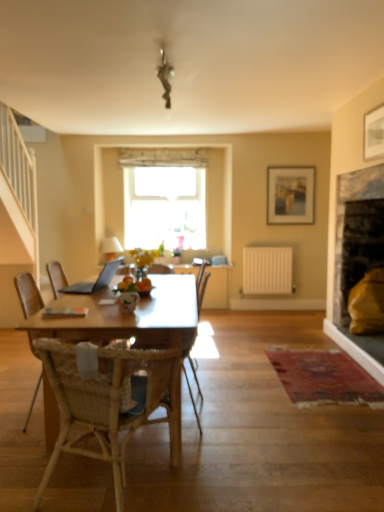
What do you see at coordinates (28, 294) in the screenshot? The image size is (384, 512). I see `woven wood chair at center, acting as the second chair starting from the front` at bounding box center [28, 294].

Image resolution: width=384 pixels, height=512 pixels. What are the coordinates of `transparent glass window at center` in the screenshot? It's located at (164, 198).

You are a GUI agent. You are given a task and a screenshot of the screen. Output one action in this format:
    pyautogui.click(x=<x>, y=<y>)
    Task: Click on the matte wooden picture frame at upper center, the second picture frame positioned from the right
    The width and height of the screenshot is (384, 512).
    Given the screenshot: What is the action you would take?
    pyautogui.click(x=290, y=195)

In order to face white matte radiator at center-right, should I rotate leftwards or rightwards?

Rotate your view right by about 10.256°.

Where is `woven wood chair at center, which is the 1th chair from front to back`? This screenshot has width=384, height=512. woven wood chair at center, which is the 1th chair from front to back is located at coordinates (106, 400).

Locate an element on the screen. woven wood chair at center, which is counted as the second chair, starting from the back is located at coordinates (28, 294).

Identify the location of the 2nd chair in front of the wooden picture frame at upper right, which appears as the first picture frame when viewed from the right, counting from the anchor's position. The height and width of the screenshot is (512, 384). (28, 294).

Consider the image. From the image's perspective, is woven wood chair at center, acting as the second chair starting from the front, over wooden picture frame at upper right, which appears as the first picture frame when viewed from the right?

No, from the image's perspective, woven wood chair at center, acting as the second chair starting from the front, is not on top of wooden picture frame at upper right, which appears as the first picture frame when viewed from the right.

What's the angular difference between woven wood chair at center, which is counted as the second chair, starting from the back, and wooden picture frame at upper right, which is counted as the 2th picture frame, starting from the back,'s facing directions?

1.02 degrees.

From the picture: Is white matte radiator at center-right at the right side of woven wood chair at center, the 3th chair when ordered from front to back?

Yes, white matte radiator at center-right is to the right of woven wood chair at center, the 3th chair when ordered from front to back.

From the image's perspective, is white matte radiator at center-right under woven wood chair at center, the 3th chair when ordered from front to back?

No, from the image's perspective, white matte radiator at center-right is not beneath woven wood chair at center, the 3th chair when ordered from front to back.

Does white matte radiator at center-right have a larger size compared to woven wood chair at center, the 1th chair when ordered from back to front?

Incorrect, white matte radiator at center-right is not larger than woven wood chair at center, the 1th chair when ordered from back to front.

Would you say white matte radiator at center-right is outside woven wood chair at center, the 1th chair when ordered from back to front?

Yes, white matte radiator at center-right is outside of woven wood chair at center, the 1th chair when ordered from back to front.

How many degrees apart are the facing directions of woven wood chair at center, which is counted as the second chair, starting from the back, and woven wood chair at center, the 3th chair when ordered from front to back?

0.611 degrees separate the facing orientations of woven wood chair at center, which is counted as the second chair, starting from the back, and woven wood chair at center, the 3th chair when ordered from front to back.

Could you tell me if woven wood chair at center, acting as the second chair starting from the front, is facing woven wood chair at center, the 3th chair when ordered from front to back?

Yes, woven wood chair at center, acting as the second chair starting from the front, faces towards woven wood chair at center, the 3th chair when ordered from front to back.

Which is behind, point (17, 290) or point (189, 351)?

The point (17, 290) is more distant.

From the image's perspective, between woven wood chair at center, which is counted as the second chair, starting from the back, and woven wood chair at center, the 3th chair when ordered from front to back, which one is located above?

woven wood chair at center, the 3th chair when ordered from front to back, appears higher in the image.

Which object is wider, woven wood chair at center, the 3th chair when ordered from front to back, or white matte radiator at center-right?

woven wood chair at center, the 3th chair when ordered from front to back, is wider.

Is woven wood chair at center, the 3th chair when ordered from front to back, positioned far away from white matte radiator at center-right?

No, there isn't a large distance between woven wood chair at center, the 3th chair when ordered from front to back, and white matte radiator at center-right.

Is woven wood chair at center, the 1th chair when ordered from back to front, not within white matte radiator at center-right?

Yes.

Between woven wood chair at center, the 3th chair when ordered from front to back, and white matte radiator at center-right, which one has smaller size?

white matte radiator at center-right.

From a real-world perspective, which is physically below, woven wood chair at center, acting as the second chair starting from the front, or silver metallic laptop at center?

From a 3D spatial view, woven wood chair at center, acting as the second chair starting from the front, is below.

Is point (20, 277) farther from viewer compared to point (78, 293)?

No.

From the image's perspective, who appears lower, woven wood chair at center, which is counted as the second chair, starting from the back, or silver metallic laptop at center?

woven wood chair at center, which is counted as the second chair, starting from the back, from the image's perspective.

Considering the sizes of woven wood chair at center, which ranks as the third chair in back-to-front order, and silver metallic laptop at center in the image, is woven wood chair at center, which ranks as the third chair in back-to-front order, wider or thinner than silver metallic laptop at center?

In the image, woven wood chair at center, which ranks as the third chair in back-to-front order, appears to be wider than silver metallic laptop at center.

Between point (123, 454) and point (80, 284), which one is positioned behind?

The point (80, 284) is more distant.

Does woven wood chair at center, which ranks as the third chair in back-to-front order, turn towards silver metallic laptop at center?

No, woven wood chair at center, which ranks as the third chair in back-to-front order, is not aimed at silver metallic laptop at center.

Considering the relative positions of silver metallic laptop at center and woven wood chair at center, acting as the second chair starting from the front, in the image provided, is silver metallic laptop at center in front of woven wood chair at center, acting as the second chair starting from the front,?

No.

From the picture: Considering the relative sizes of silver metallic laptop at center and woven wood chair at center, acting as the second chair starting from the front, in the image provided, is silver metallic laptop at center smaller than woven wood chair at center, acting as the second chair starting from the front,?

Yes, silver metallic laptop at center is smaller than woven wood chair at center, acting as the second chair starting from the front.

Considering the sizes of silver metallic laptop at center and woven wood chair at center, acting as the second chair starting from the front, in the image, is silver metallic laptop at center wider or thinner than woven wood chair at center, acting as the second chair starting from the front,?

silver metallic laptop at center is thinner than woven wood chair at center, acting as the second chair starting from the front.

From a real-world perspective, who is located higher, silver metallic laptop at center or woven wood chair at center, which is counted as the second chair, starting from the back?

silver metallic laptop at center, from a real-world perspective.

From the image's perspective, starting from the woven wood chair at center, which is counted as the second chair, starting from the back, which picture frame is the 2nd one above? Please provide its 2D coordinates.

[(374, 133)]

Where is `radiator above the woven wood chair at center, the 1th chair when ordered from back to front (from a real-world perspective)`? radiator above the woven wood chair at center, the 1th chair when ordered from back to front (from a real-world perspective) is located at coordinates [x=267, y=270].

Which object lies further to the anchor point transparent glass window at center, woven wood chair at center, the 1th chair when ordered from back to front, or woven wood chair at center, which is the 1th chair from front to back?

woven wood chair at center, which is the 1th chair from front to back, lies further to transparent glass window at center than the other object.

Which object lies nearer to the anchor point silver metallic laptop at center, woven wood chair at center, which is the 1th chair from front to back, or white matte radiator at center-right?

woven wood chair at center, which is the 1th chair from front to back, is closer to silver metallic laptop at center.

Looking at the image, which one is located further to transparent glass window at center, woven wood chair at center, the 3th chair when ordered from front to back, or matte wooden picture frame at upper center, the second picture frame positioned from the right?

Among the two, woven wood chair at center, the 3th chair when ordered from front to back, is located further to transparent glass window at center.

Estimate the real-world distances between objects in this image. Which object is further from matte wooden picture frame at upper center, the 2th picture frame from the front, white glossy vase at center or wooden picture frame at upper right, which is counted as the 2th picture frame, starting from the back?

white glossy vase at center lies further to matte wooden picture frame at upper center, the 2th picture frame from the front, than the other object.

Looking at this image, estimate the real-world distances between objects in this image. Which object is further from woven wood chair at center, acting as the second chair starting from the front, white matte radiator at center-right or woven wood chair at center, the 1th chair when ordered from back to front?

The object further to woven wood chair at center, acting as the second chair starting from the front, is white matte radiator at center-right.

Estimate the real-world distances between objects in this image. Which object is further from transparent glass window at center, woven wood chair at center, which ranks as the third chair in back-to-front order, or woven wood chair at center, the 3th chair when ordered from front to back?

woven wood chair at center, which ranks as the third chair in back-to-front order, is positioned further to the anchor transparent glass window at center.

Considering their positions, is matte wooden picture frame at upper center, the 2th picture frame from the front, positioned further to white glossy vase at center than white matte radiator at center-right?

The object further to white glossy vase at center is matte wooden picture frame at upper center, the 2th picture frame from the front.

When comparing their distances from white glossy vase at center, does white matte radiator at center-right or woven wood chair at center, the 3th chair when ordered from front to back, seem further?

Based on the image, white matte radiator at center-right appears to be further to white glossy vase at center.

Locate an element on the screen. This screenshot has height=512, width=384. radiator positioned between woven wood chair at center, which is counted as the second chair, starting from the back, and transparent glass window at center from near to far is located at coordinates (267, 270).

What are the coordinates of `laptop located between woven wood chair at center, acting as the second chair starting from the front, and white matte radiator at center-right in the depth direction` in the screenshot? It's located at point(95,281).

You are a GUI agent. You are given a task and a screenshot of the screen. Output one action in this format:
    pyautogui.click(x=<x>, y=<y>)
    Task: Click on the picture frame located between silver metallic laptop at center and matte wooden picture frame at upper center, the 2th picture frame from the front, in the depth direction
    
    Given the screenshot: What is the action you would take?
    (374, 133)

Where is `vase located between woven wood chair at center, which is the 1th chair from front to back, and wooden picture frame at upper right, which is counted as the 2th picture frame, starting from the back, in the left-right direction`? vase located between woven wood chair at center, which is the 1th chair from front to back, and wooden picture frame at upper right, which is counted as the 2th picture frame, starting from the back, in the left-right direction is located at coordinates (128, 301).